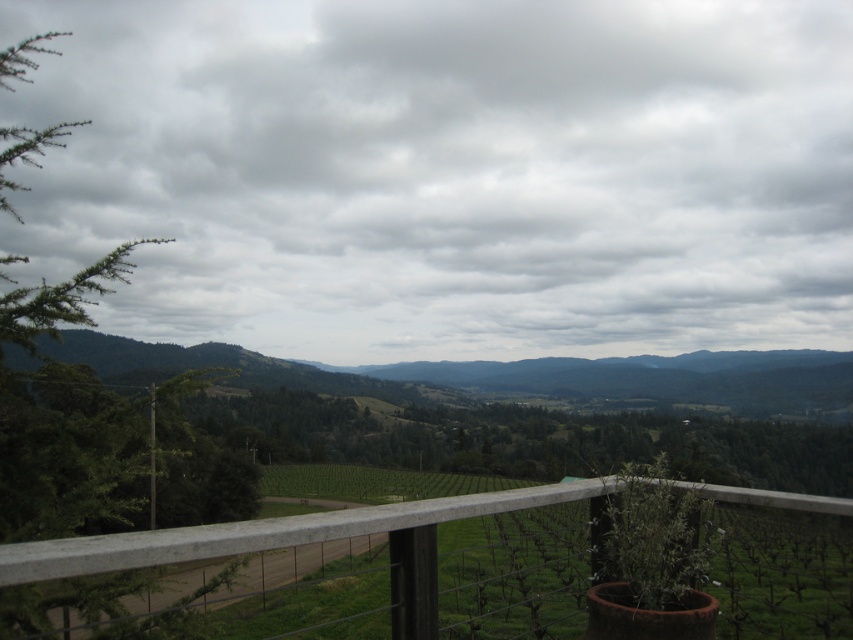
You are standing on a balcony overlooking a vineyard. You notice a cloudy sky at upper center and a white concrete fence at lower center. Which object is closer to you from your current position?

The white concrete fence at lower center is closer to you because it is positioned behind the cloudy sky at upper center, meaning the cloudy sky is farther away.

You are standing at the point with coordinates point [849,500] and want to walk to the point [279,291]. Will the railing on the right side of the railing block your path?

Point [279,291] is behind point [849,500], so walking from point [849,500] to point [279,291] would require moving away from the railing on the right side of the railing. Therefore, the railing will not block your path.